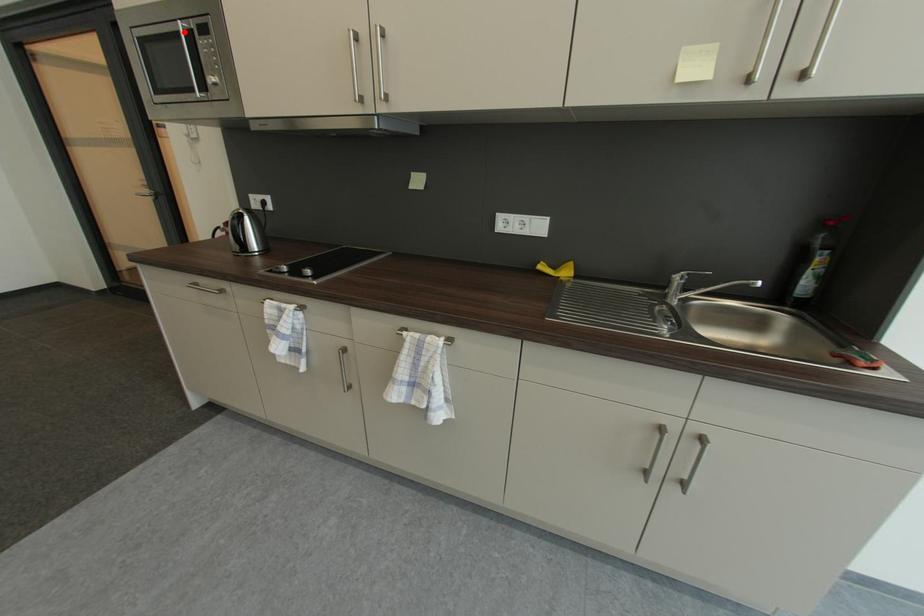
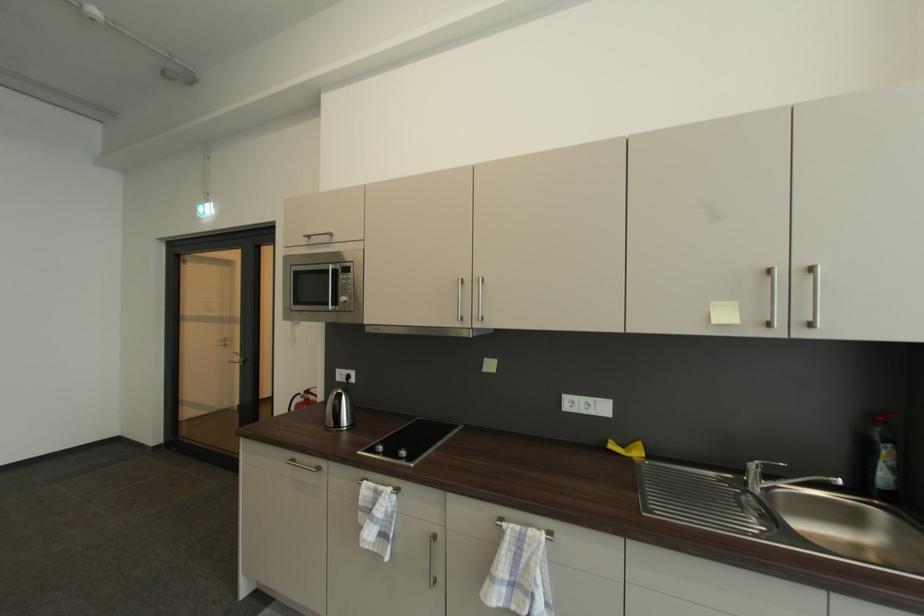
Find the pixel in the second image that matches the highlighted location in the first image.

(334, 272)